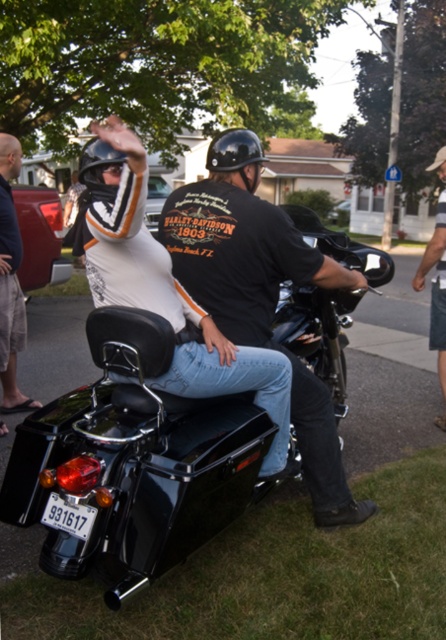
Who is more forward, (28, 406) or (90, 164)?

Point (90, 164) is in front.

Which is behind, point (12, 401) or point (93, 141)?

The point (12, 401) is more distant.

This screenshot has width=446, height=640. I want to click on matte black helmet at upper left, so click(11, 282).

Does black glossy motorcycle at center appear on the left side of denim shorts at lower right?

Indeed, black glossy motorcycle at center is positioned on the left side of denim shorts at lower right.

Which of these two, black glossy motorcycle at center or denim shorts at lower right, stands shorter?

black glossy motorcycle at center is shorter.

This screenshot has height=640, width=446. What are the coordinates of `black glossy motorcycle at center` in the screenshot? It's located at (131, 461).

Is point (432, 264) positioned after point (226, 132)?

Yes, it is.

Which of these two, denim shorts at lower right or black matte helmet at center, stands shorter?

Standing shorter between the two is black matte helmet at center.

The width and height of the screenshot is (446, 640). What do you see at coordinates (436, 288) in the screenshot?
I see `denim shorts at lower right` at bounding box center [436, 288].

You are a GUI agent. You are given a task and a screenshot of the screen. Output one action in this format:
    pyautogui.click(x=<x>, y=<y>)
    Task: Click on the denim shorts at lower right
    The image size is (446, 640).
    Given the screenshot: What is the action you would take?
    [436, 288]